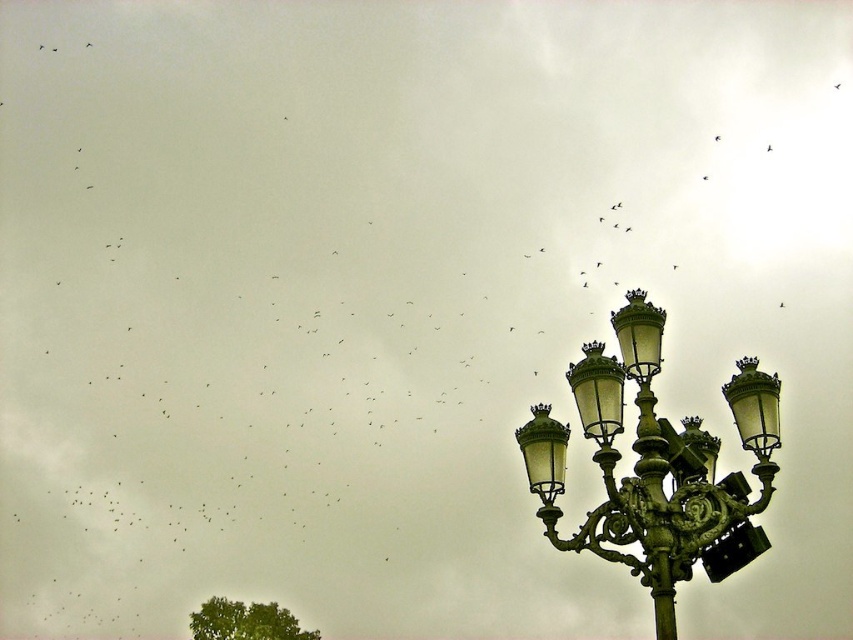
Question: Which object appears farthest from the camera in this image?

Choices:
 (A) green patinated metal street light at right
 (B) green leafy tree at lower left

Answer: (B)

Question: Can you confirm if green patinated metal street light at right is positioned to the right of green leafy tree at lower left?

Choices:
 (A) yes
 (B) no

Answer: (A)

Question: Can you confirm if green patinated metal street light at right is bigger than green leafy tree at lower left?

Choices:
 (A) yes
 (B) no

Answer: (A)

Question: Which point appears farthest from the camera in this image?

Choices:
 (A) (656, 426)
 (B) (248, 632)

Answer: (B)

Question: Does green patinated metal street light at right have a smaller size compared to green leafy tree at lower left?

Choices:
 (A) yes
 (B) no

Answer: (B)

Question: Which point is closer to the camera?

Choices:
 (A) (525, 465)
 (B) (242, 637)

Answer: (A)